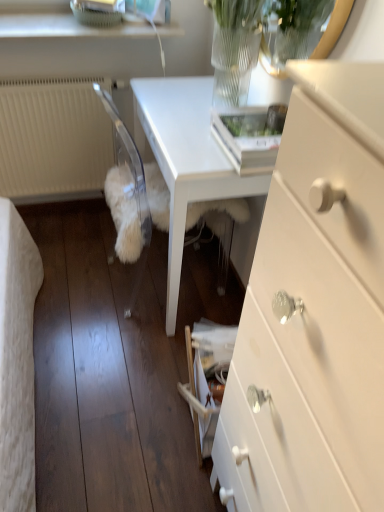
Question: Based on their positions, is white textured radiator at left located to the left or right of white glossy table at center?

Choices:
 (A) right
 (B) left

Answer: (B)

Question: Would you say white textured radiator at left is inside or outside white glossy table at center?

Choices:
 (A) outside
 (B) inside

Answer: (A)

Question: Based on their relative distances, which object is farther from the white fluffy dog at lower center?

Choices:
 (A) white glossy chest of drawers at center right
 (B) white glossy table at center
 (C) white textured radiator at left

Answer: (A)

Question: Estimate the real-world distances between objects in this image. Which object is closer to the white textured radiator at left?

Choices:
 (A) white fluffy dog at lower center
 (B) white glossy table at center
 (C) white glossy chest of drawers at center right

Answer: (A)